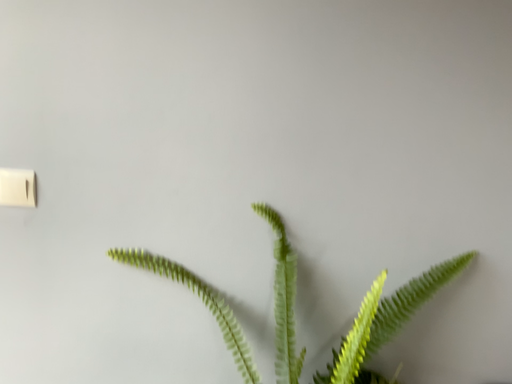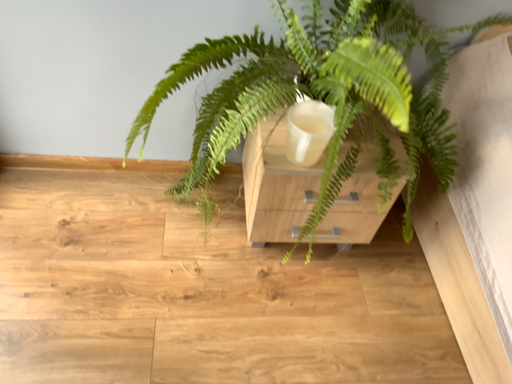
Question: How did the camera likely rotate when shooting the video?

Choices:
 (A) rotated upward
 (B) rotated downward

Answer: (B)